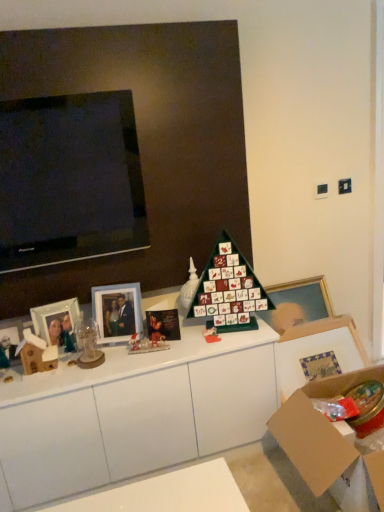
At what (x,y) coordinates should I click in order to perform the action: click on free space to the left of green matte advent calendar at center. Please return your answer as a coordinate pair (x, y). The image size is (384, 512). Looking at the image, I should click on pos(176,347).